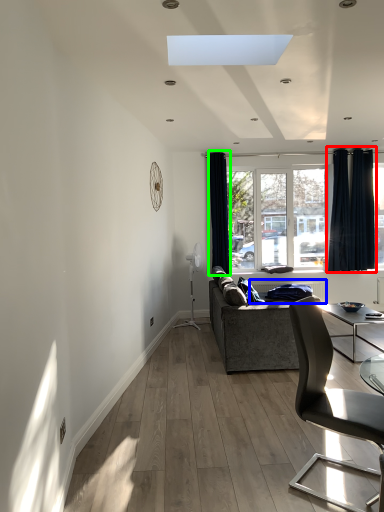
Question: Which object is positioned closest to curtain (highlighted by a red box)? Select from radiator (highlighted by a blue box) and curtain (highlighted by a green box).

Choices:
 (A) radiator
 (B) curtain

Answer: (A)